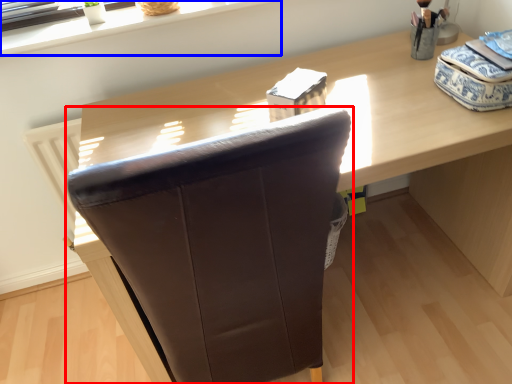
Question: Which of the following is the farthest to the observer, chair (highlighted by a red box) or window sill (highlighted by a blue box)?

Choices:
 (A) chair
 (B) window sill

Answer: (B)